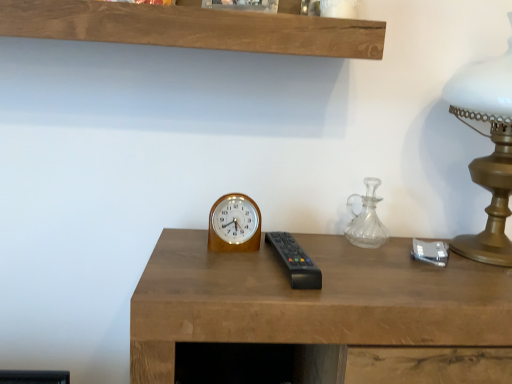
Locate an element on the screen. The image size is (512, 384). space that is in front of black plastic remote at center is located at coordinates (292, 304).